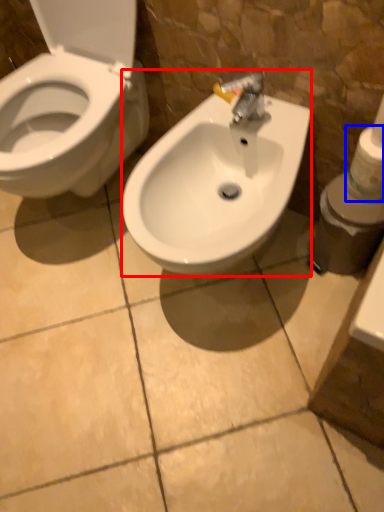
Question: Among these objects, which one is farthest to the camera, sink (highlighted by a red box) or toilet paper (highlighted by a blue box)?

Choices:
 (A) sink
 (B) toilet paper

Answer: (B)